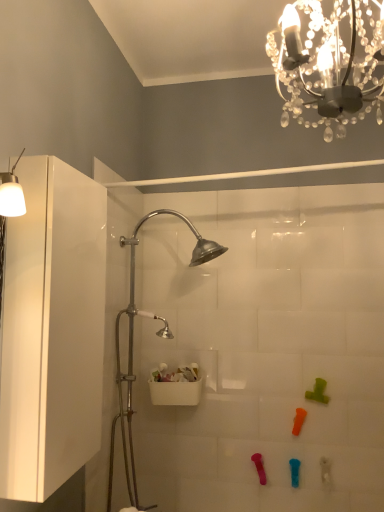
Question: Is orange rubber toy at lower center, the third toy positioned from the right, to the left or to the right of clear crystal chandelier at upper center in the image?

Choices:
 (A) right
 (B) left

Answer: (A)

Question: From the image's perspective, is orange rubber toy at lower center, the third toy viewed from the left, located above or below clear crystal chandelier at upper center?

Choices:
 (A) above
 (B) below

Answer: (B)

Question: Estimate the real-world distances between objects in this image. Which object is closer to the clear crystal chandelier at upper center?

Choices:
 (A) translucent plastic toy at lower right, arranged as the 1th toy when viewed from the right
 (B) white plastic shower door at center
 (C) orange rubber toy at lower center, the third toy viewed from the left
 (D) pink rubber toy at lower center, positioned as the 5th toy in right-to-left order
 (E) white glossy cabinet at left

Answer: (E)

Question: Which of these objects is positioned farthest from the blue rubber toy at lower center, which is counted as the 4th toy, starting from the right?

Choices:
 (A) translucent plastic toy at lower right, arranged as the 1th toy when viewed from the right
 (B) clear crystal chandelier at upper center
 (C) orange rubber toy at lower center, the third toy positioned from the right
 (D) green rubber toy at upper right, the second toy viewed from the right
 (E) pink rubber toy at lower center, the 1th toy when ordered from left to right

Answer: (B)